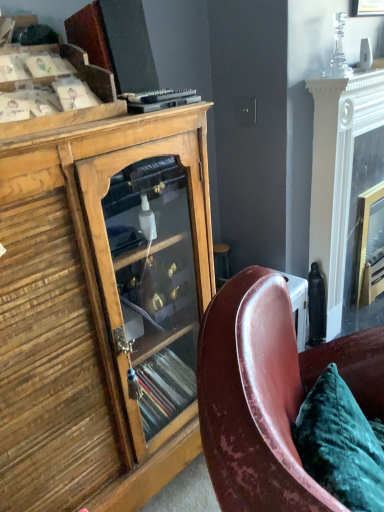
Question: From the image's perspective, relative to black plastic remote control at upper center, is wooden cabinet at left above or below?

Choices:
 (A) below
 (B) above

Answer: (A)

Question: Is point (172, 320) positioned closer to the camera than point (185, 96)?

Choices:
 (A) farther
 (B) closer

Answer: (A)

Question: Which object is the closest to the wooden cabinet at left?

Choices:
 (A) white glossy fireplace at right
 (B) wooden cabinet at upper left
 (C) velvet green pillow at lower right
 (D) leather at right
 (E) black plastic remote control at upper center

Answer: (D)

Question: Which is farther from the leather at right?

Choices:
 (A) velvet green pillow at lower right
 (B) wooden cabinet at left
 (C) wooden cabinet at upper left
 (D) black plastic remote control at upper center
 (E) white glossy fireplace at right

Answer: (E)